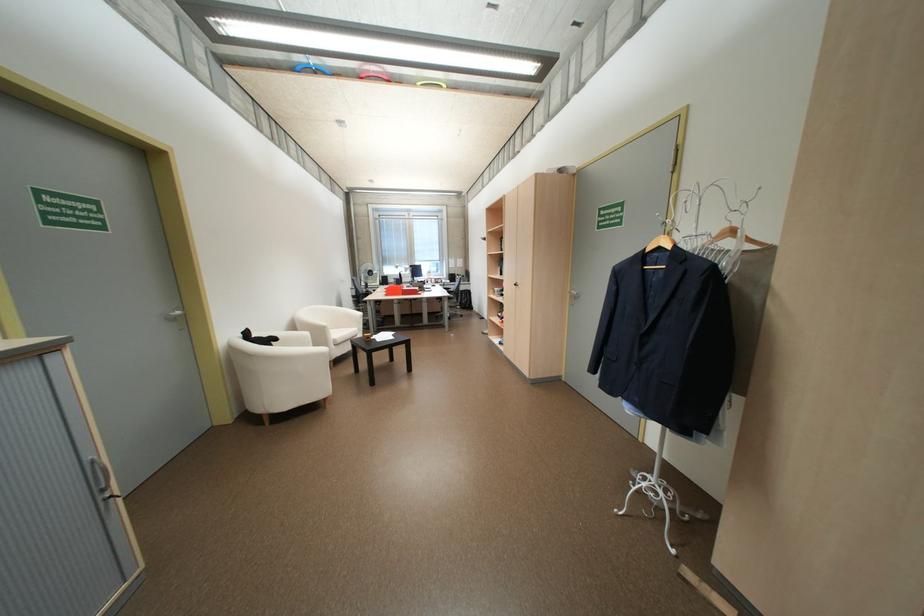
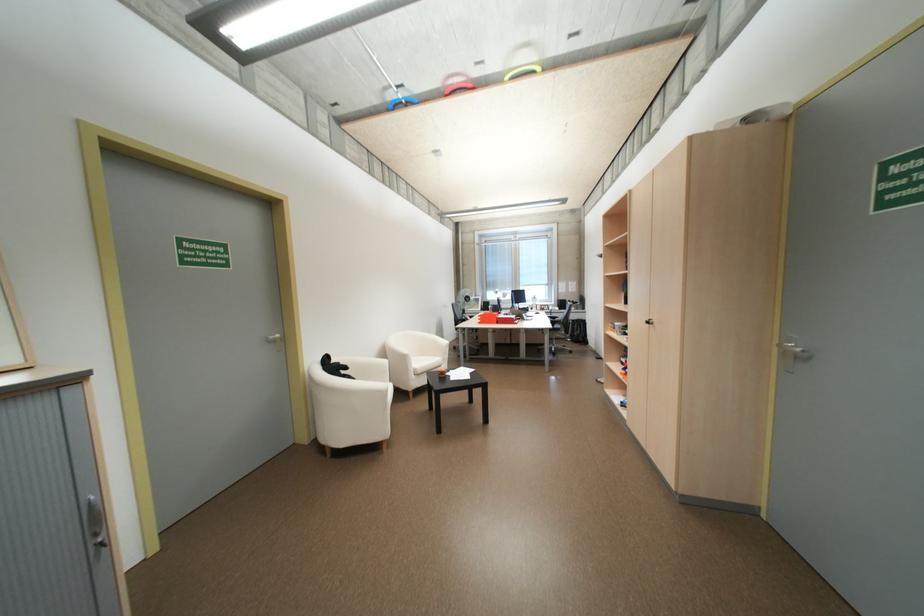
In the second image, find the point that corresponds to (330,334) in the first image.

(408, 363)